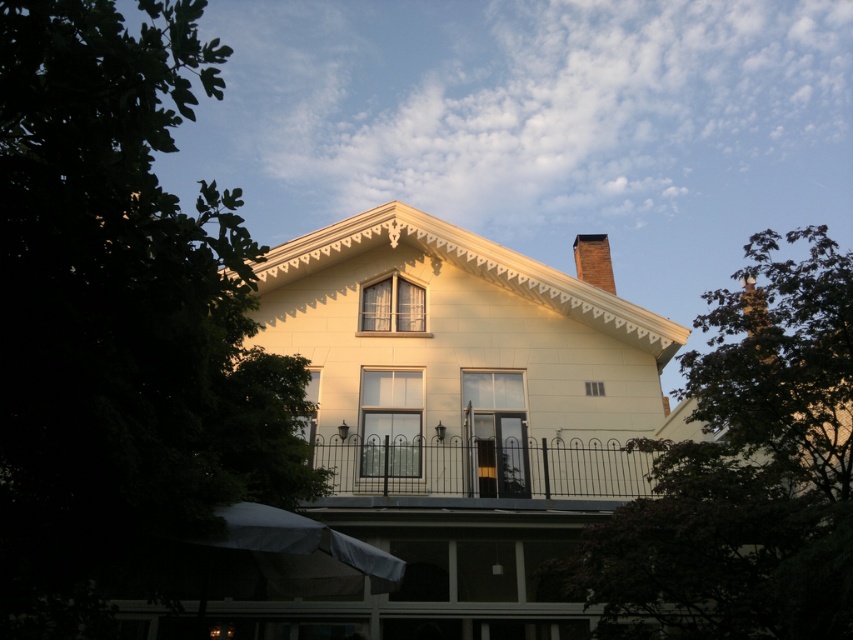
Does green leafy tree at left appear over black metal fence at center?

Indeed, green leafy tree at left is positioned over black metal fence at center.

Measure the distance between point (9,308) and camera.

Point (9,308) and camera are 4.27 meters apart.

Where is `green leafy tree at left`? The image size is (853, 640). green leafy tree at left is located at coordinates (119, 316).

Between green leafy tree at upper right and black metal fence at center, which one is positioned higher?

green leafy tree at upper right is above.

Can you confirm if green leafy tree at upper right is positioned below black metal fence at center?

No.

Image resolution: width=853 pixels, height=640 pixels. Describe the element at coordinates (746, 472) in the screenshot. I see `green leafy tree at upper right` at that location.

You are a GUI agent. You are given a task and a screenshot of the screen. Output one action in this format:
    pyautogui.click(x=<x>, y=<y>)
    Task: Click on the green leafy tree at upper right
    
    Given the screenshot: What is the action you would take?
    pyautogui.click(x=746, y=472)

Looking at this image, between green leafy tree at left and green leafy tree at upper right, which one has more height?

Standing taller between the two is green leafy tree at left.

From the picture: Does green leafy tree at left appear under green leafy tree at upper right?

Actually, green leafy tree at left is above green leafy tree at upper right.

Between point (84, 8) and point (813, 250), which one is positioned in front?

Positioned in front is point (84, 8).

Find the location of a particular element. This screenshot has height=640, width=853. green leafy tree at left is located at coordinates (119, 316).